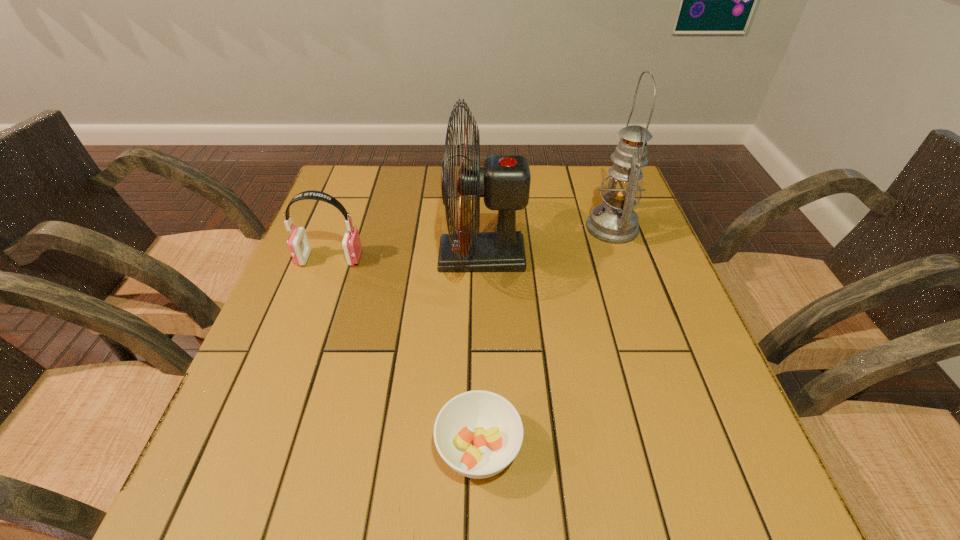
I want to click on vacant space situated 0.190m on the outer surface of the earphone, so click(x=439, y=259).

The width and height of the screenshot is (960, 540). Find the location of `free space located 0.320m on the back of the nearest object`. free space located 0.320m on the back of the nearest object is located at coordinates (479, 285).

At what (x,y) coordinates should I click in order to perform the action: click on object present at the far edge. Please return your answer as a coordinate pair (x, y). The width and height of the screenshot is (960, 540). Looking at the image, I should click on (614, 221).

Locate an element on the screen. Image resolution: width=960 pixels, height=540 pixels. object positioned at the near edge is located at coordinates (478, 433).

Where is `object that is at the left edge`? object that is at the left edge is located at coordinates (298, 243).

You are a GUI agent. You are given a task and a screenshot of the screen. Output one action in this format:
    pyautogui.click(x=<x>, y=<y>)
    Task: Click on the object that is positioned at the right edge
    This screenshot has height=540, width=960.
    Given the screenshot: What is the action you would take?
    pyautogui.click(x=614, y=221)

Locate an element on the screen. The image size is (960, 540). object at the far right corner is located at coordinates (614, 221).

Where is `vacant space at the far edge`? This screenshot has height=540, width=960. vacant space at the far edge is located at coordinates (385, 191).

At what (x,y) coordinates should I click in order to perform the action: click on vacant space at the near edge of the desktop. Please return your answer as a coordinate pair (x, y). The image size is (960, 540). Looking at the image, I should click on (454, 498).

Image resolution: width=960 pixels, height=540 pixels. Identify the location of free location at the left edge. (312, 260).